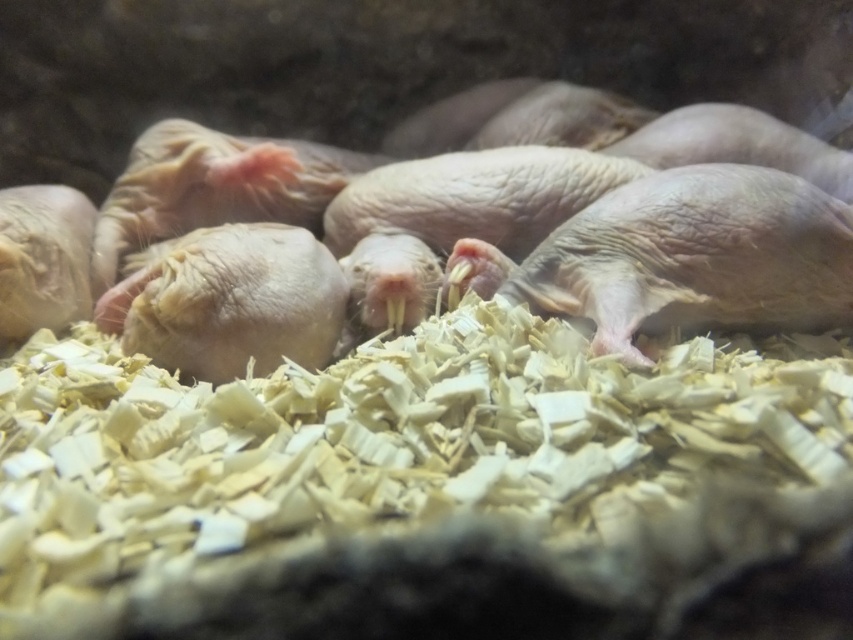
Which is above, pink smooth rodent at center or pink wrinkled mole at left?

pink wrinkled mole at left is above.

Which is in front, point (201, 259) or point (78, 252)?

Point (201, 259)

The image size is (853, 640). Identify the location of pink smooth rodent at center. pyautogui.click(x=230, y=301).

Identify the location of pink smooth rodent at center. This screenshot has height=640, width=853. (230, 301).

Between pinkish-brown wrinkled mole at center and pink wrinkled mole at left, which one is positioned lower?

Positioned lower is pink wrinkled mole at left.

Can you confirm if pinkish-brown wrinkled mole at center is positioned to the right of pink wrinkled mole at left?

Yes, pinkish-brown wrinkled mole at center is to the right of pink wrinkled mole at left.

Locate an element on the screen. pinkish-brown wrinkled mole at center is located at coordinates (634, 216).

At what (x,y) coordinates should I click in order to perform the action: click on pinkish-brown wrinkled mole at center. Please return your answer as a coordinate pair (x, y). Looking at the image, I should click on (634, 216).

Does white shredded wood at center appear on the right side of pink wrinkled mole at left?

Correct, you'll find white shredded wood at center to the right of pink wrinkled mole at left.

Is white shredded wood at center taller than pink wrinkled mole at left?

Incorrect, white shredded wood at center's height is not larger of pink wrinkled mole at left's.

Is point (527, 518) positioned after point (62, 214)?

No, it is in front of (62, 214).

The image size is (853, 640). Identify the location of white shredded wood at center. (407, 484).